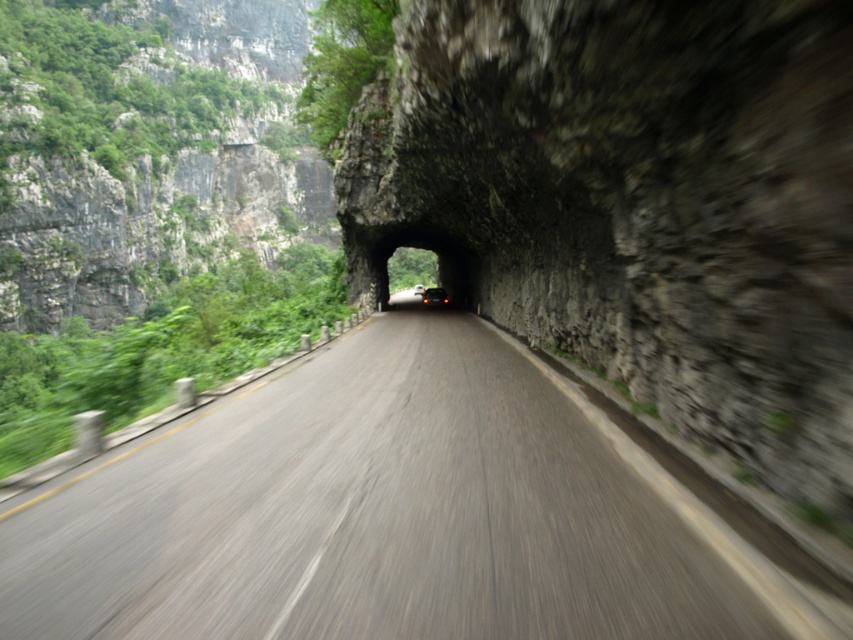
Question: Can you confirm if green rough rock at left is thinner than shiny black car at center?

Choices:
 (A) no
 (B) yes

Answer: (A)

Question: Is smooth asphalt road at center above matte black car at center?

Choices:
 (A) no
 (B) yes

Answer: (A)

Question: Which point appears closest to the camera in this image?

Choices:
 (A) (425, 291)
 (B) (524, 378)
 (C) (45, 86)
 (D) (416, 291)

Answer: (B)

Question: Based on their relative distances, which object is nearer to the smooth asphalt road at center?

Choices:
 (A) shiny black car at center
 (B) green rough rock at left

Answer: (A)

Question: Among these objects, which one is farthest from the camera?

Choices:
 (A) matte black car at center
 (B) green rough rock at left
 (C) shiny black car at center
 (D) smooth asphalt road at center

Answer: (C)

Question: In this image, where is green rough rock at left located relative to shiny black car at center?

Choices:
 (A) above
 (B) below

Answer: (A)